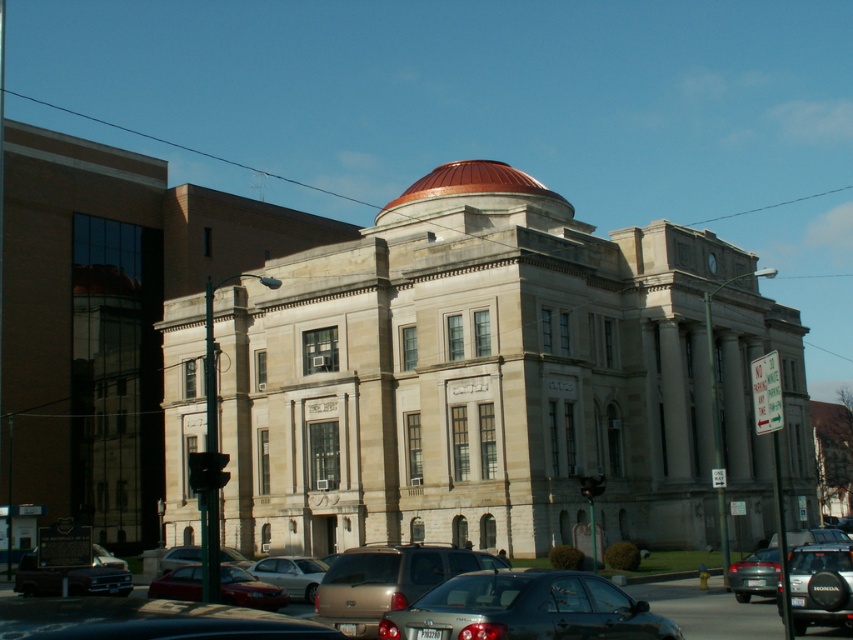
Who is lower down, matte silver sedan at lower right or metallic silver sedan at center?

metallic silver sedan at center

Between matte silver sedan at lower right and metallic silver sedan at center, which one is positioned higher?

matte silver sedan at lower right

Locate an element on the screen. The width and height of the screenshot is (853, 640). matte silver sedan at lower right is located at coordinates (753, 573).

Does metallic gray sedan at center lie in front of black matte suv at lower right?

Yes, metallic gray sedan at center is closer to the viewer.

Is metallic gray sedan at center above black matte suv at lower right?

Correct, metallic gray sedan at center is located above black matte suv at lower right.

At what (x,y) coordinates should I click in order to perform the action: click on metallic gray sedan at center. Please return your answer as a coordinate pair (x, y). Looking at the image, I should click on (526, 609).

Describe the element at coordinates (291, 573) in the screenshot. I see `silver metallic sedan at center` at that location.

Is point (273, 570) positioned behind point (740, 580)?

Yes, it is behind point (740, 580).

What do you see at coordinates (291, 573) in the screenshot?
I see `silver metallic sedan at center` at bounding box center [291, 573].

Where is `silver metallic sedan at center`? This screenshot has height=640, width=853. silver metallic sedan at center is located at coordinates (291, 573).